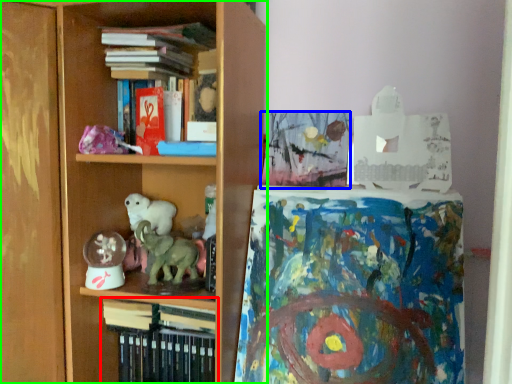
Question: Considering the real-world distances, which object is closest to book (highlighted by a red box)? book (highlighted by a blue box) or shelf (highlighted by a green box).

Choices:
 (A) book
 (B) shelf

Answer: (B)